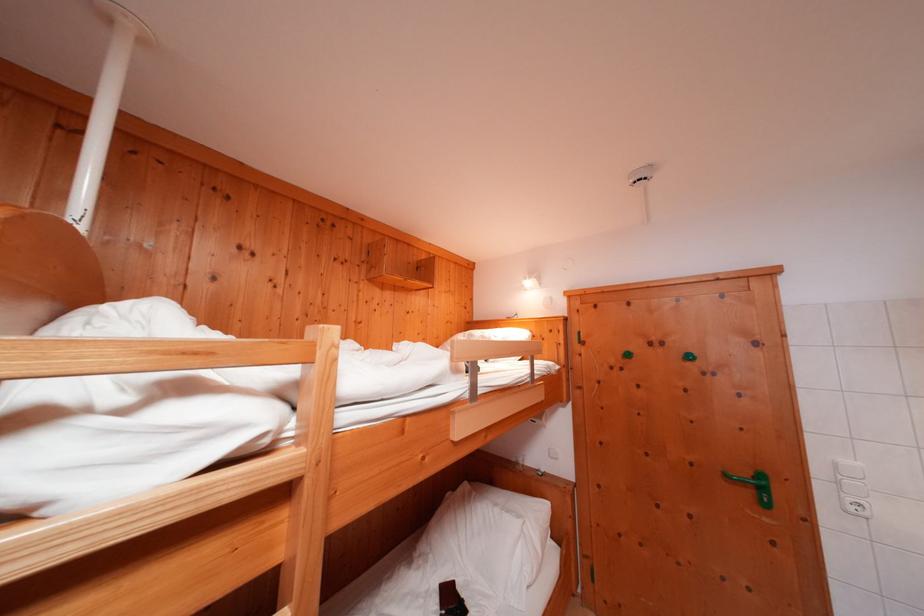
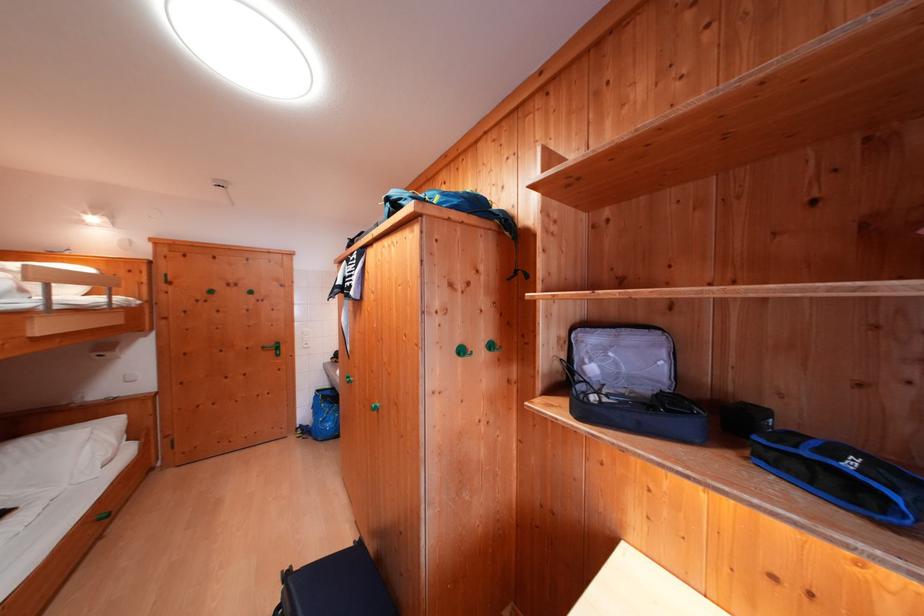
Find the pixel in the second image that matches point 755,477 in the first image.

(280, 349)